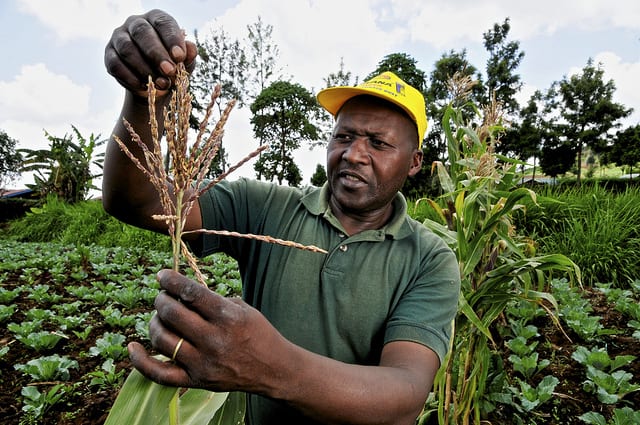
Identify the location of plants on the right. This screenshot has width=640, height=425. (473, 366), (470, 178), (459, 130).